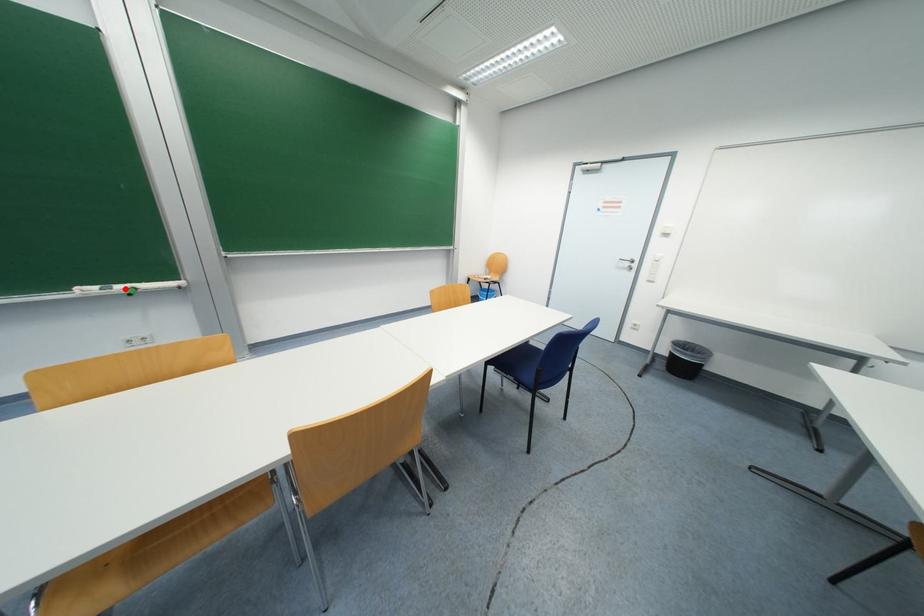
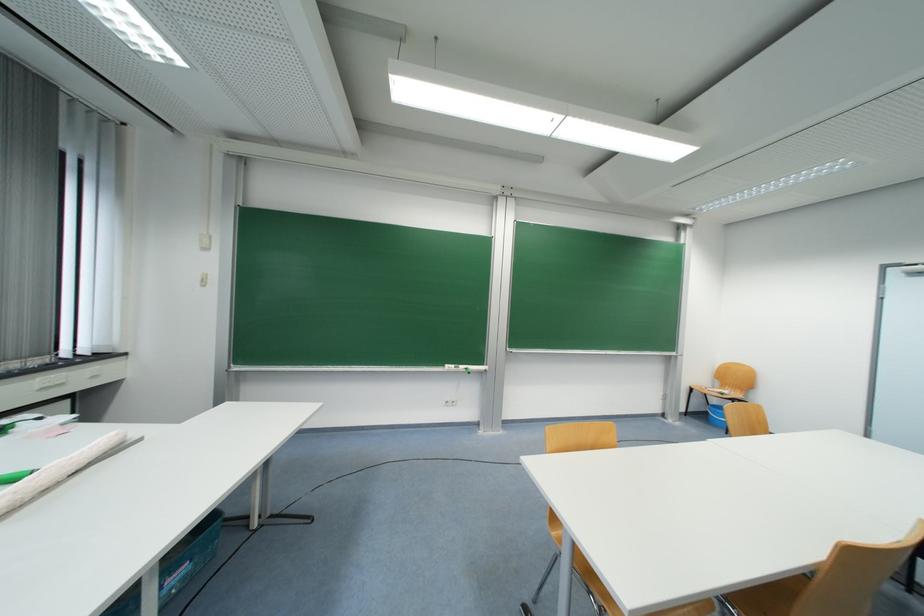
The point at the highlighted location is marked in the first image. Where is the corresponding point in the second image?

(467, 369)